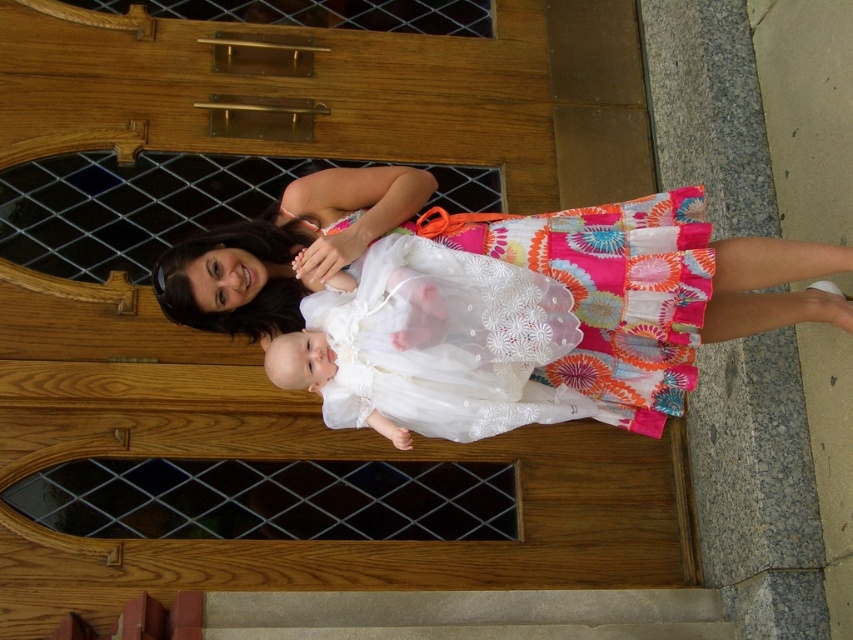
Find the location of `white lace dress at center`. white lace dress at center is located at coordinates (610, 291).

Between white lace dress at center and smooth concrete stair at lower center, which one appears on the left side from the viewer's perspective?

smooth concrete stair at lower center is more to the left.

Which is behind, point (683, 260) or point (695, 636)?

Positioned behind is point (695, 636).

Identify the location of white lace dress at center. (610, 291).